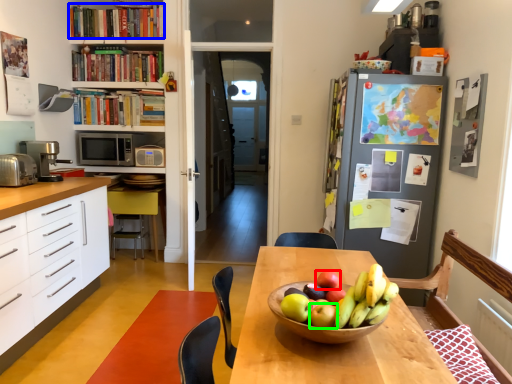
Question: Which is farther away from apple (highlighted by a red box)? book (highlighted by a blue box) or apple (highlighted by a green box)?

Choices:
 (A) book
 (B) apple

Answer: (A)